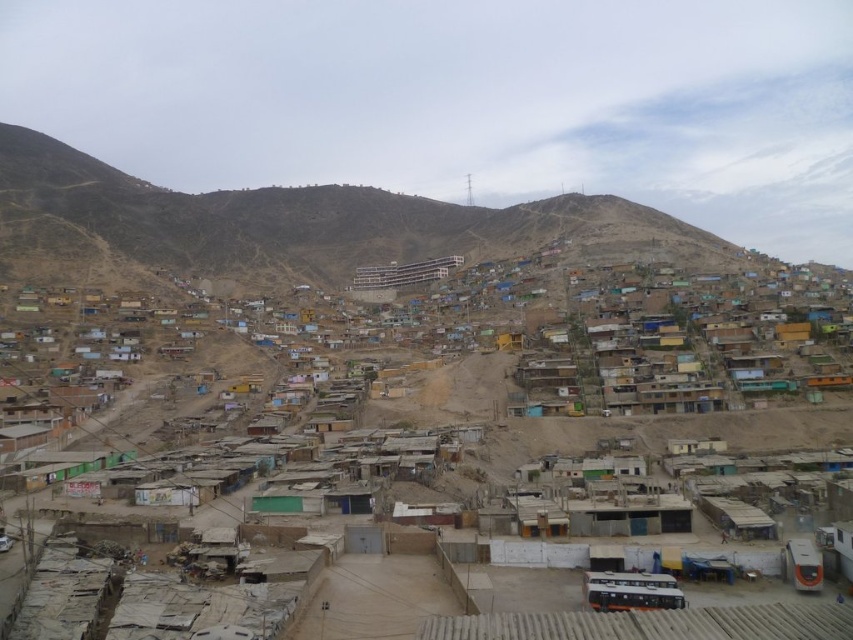
Question: Which point appears closest to the camera in this image?

Choices:
 (A) (346, 380)
 (B) (347, 266)

Answer: (A)

Question: Does rustic adobe houses at center appear under dull brown hillside at upper center?

Choices:
 (A) no
 (B) yes

Answer: (B)

Question: Among these objects, which one is farthest from the camera?

Choices:
 (A) rustic adobe houses at center
 (B) dull brown hillside at upper center

Answer: (B)

Question: Is rustic adobe houses at center positioned at the back of dull brown hillside at upper center?

Choices:
 (A) no
 (B) yes

Answer: (A)

Question: Does rustic adobe houses at center have a greater width compared to dull brown hillside at upper center?

Choices:
 (A) yes
 (B) no

Answer: (B)